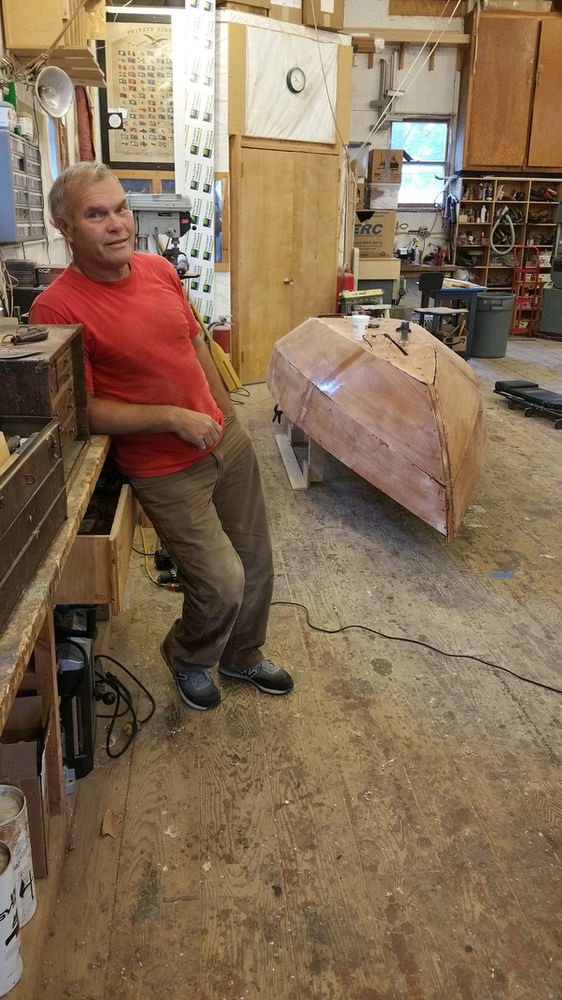
Locate an element on the screen. The image size is (562, 1000). floor is located at coordinates (482, 951).